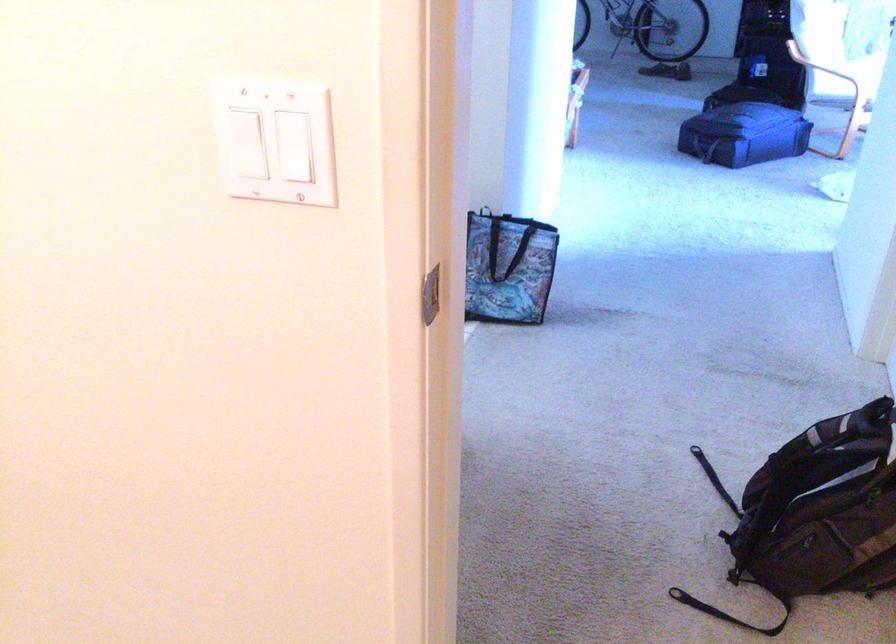
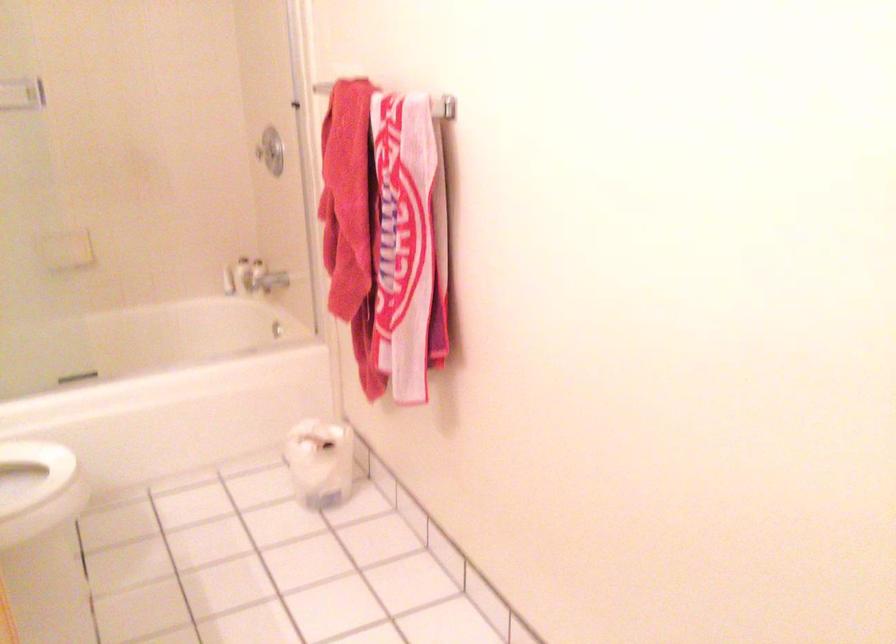
Question: The camera is either moving clockwise (left) or counter-clockwise (right) around the object. The first image is from the beginning of the video and the second image is from the end. Is the camera moving left or right when shooting the video?

Choices:
 (A) Left
 (B) Right

Answer: (B)